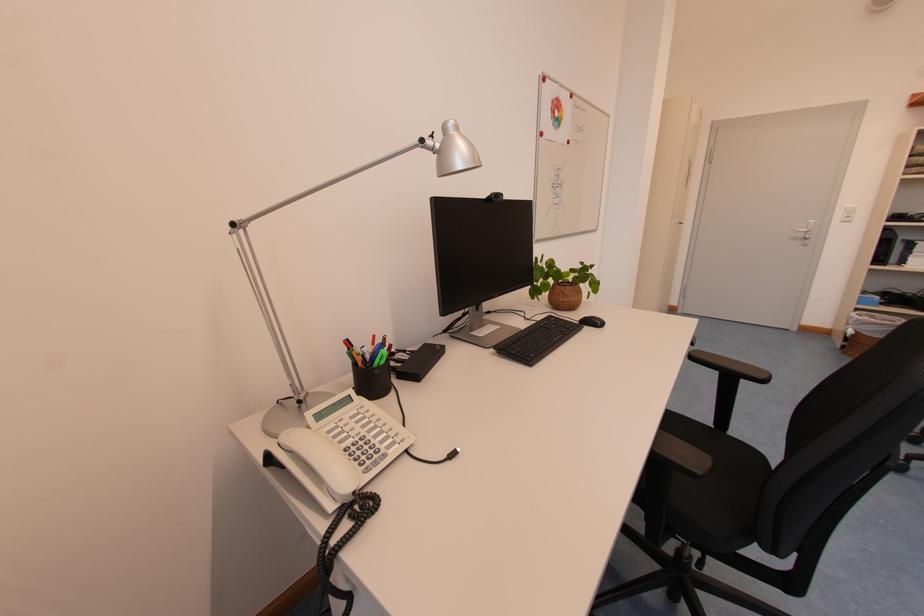
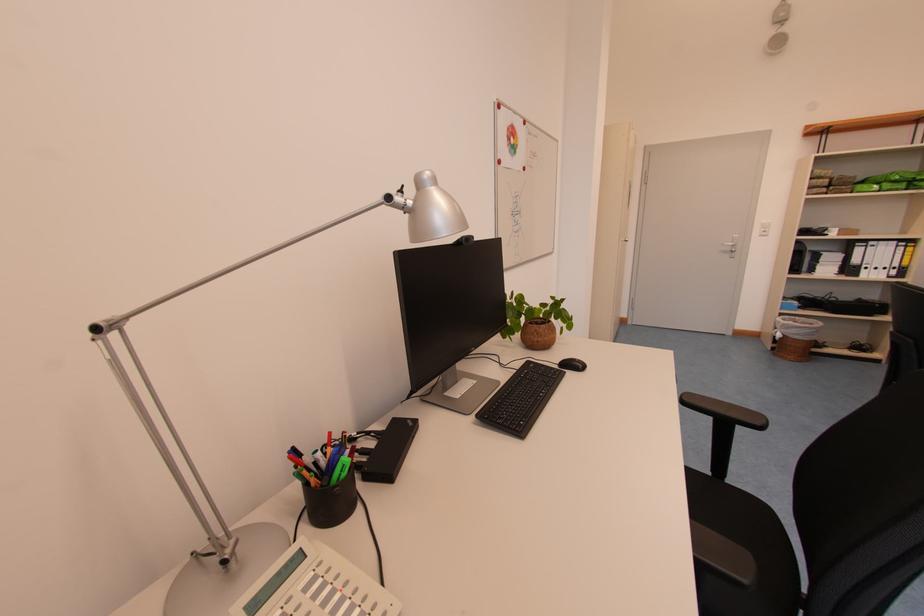
In the second image, find the point that corresponds to (x=561, y=342) in the first image.

(546, 398)